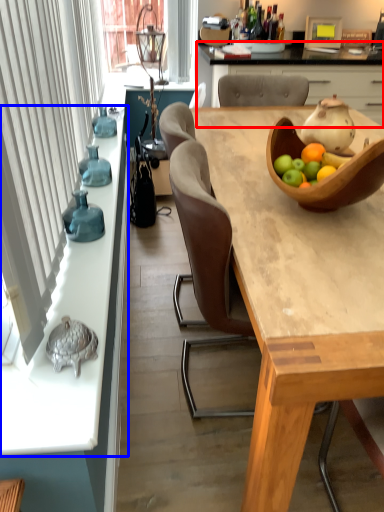
Question: Among these objects, which one is farthest to the camera, cabinetry (highlighted by a red box) or countertop (highlighted by a blue box)?

Choices:
 (A) cabinetry
 (B) countertop

Answer: (A)